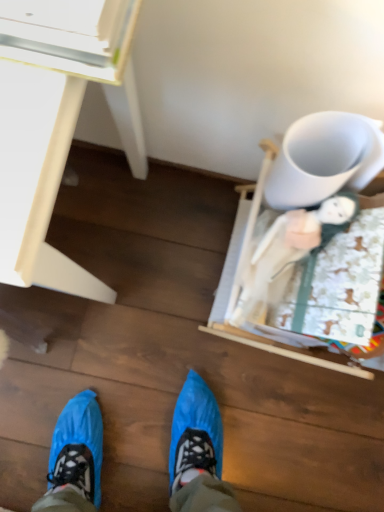
Question: In the image, is white matte mug at upper right positioned in front of or behind white glossy desk at upper left?

Choices:
 (A) front
 (B) behind

Answer: (B)

Question: Is point (294, 206) positioned closer to the camera than point (120, 19)?

Choices:
 (A) farther
 (B) closer

Answer: (A)

Question: Considering the positions of white matte mug at upper right and white glossy desk at upper left in the image, is white matte mug at upper right taller or shorter than white glossy desk at upper left?

Choices:
 (A) tall
 (B) short

Answer: (B)

Question: From the image's perspective, relative to white matte mug at upper right, is white glossy desk at upper left above or below?

Choices:
 (A) above
 (B) below

Answer: (B)

Question: Is white glossy desk at upper left in front of or behind white matte mug at upper right in the image?

Choices:
 (A) front
 (B) behind

Answer: (A)

Question: From their relative heights in the image, would you say white glossy desk at upper left is taller or shorter than white matte mug at upper right?

Choices:
 (A) short
 (B) tall

Answer: (B)

Question: Does point (66, 91) appear closer or farther from the camera than point (274, 202)?

Choices:
 (A) closer
 (B) farther

Answer: (A)